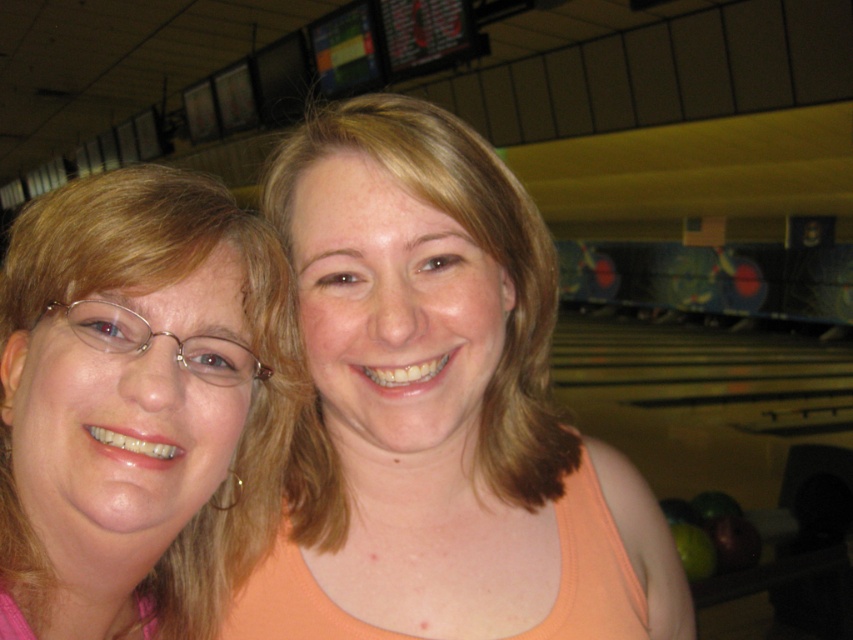
Is matte peach tank top at center below pink fabric at left?

Yes.

The width and height of the screenshot is (853, 640). I want to click on matte peach tank top at center, so click(439, 408).

The height and width of the screenshot is (640, 853). I want to click on matte peach tank top at center, so click(439, 408).